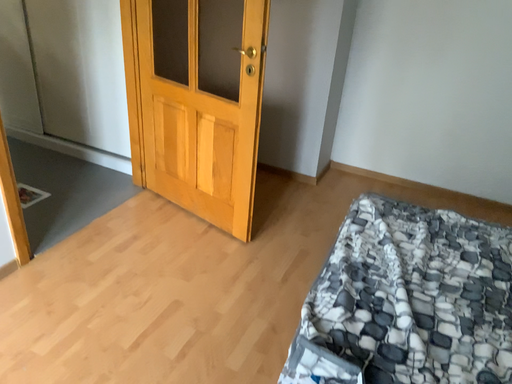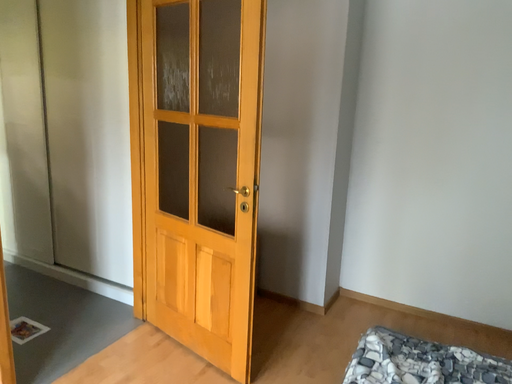
Question: How did the camera likely rotate when shooting the video?

Choices:
 (A) rotated downward
 (B) rotated upward

Answer: (B)